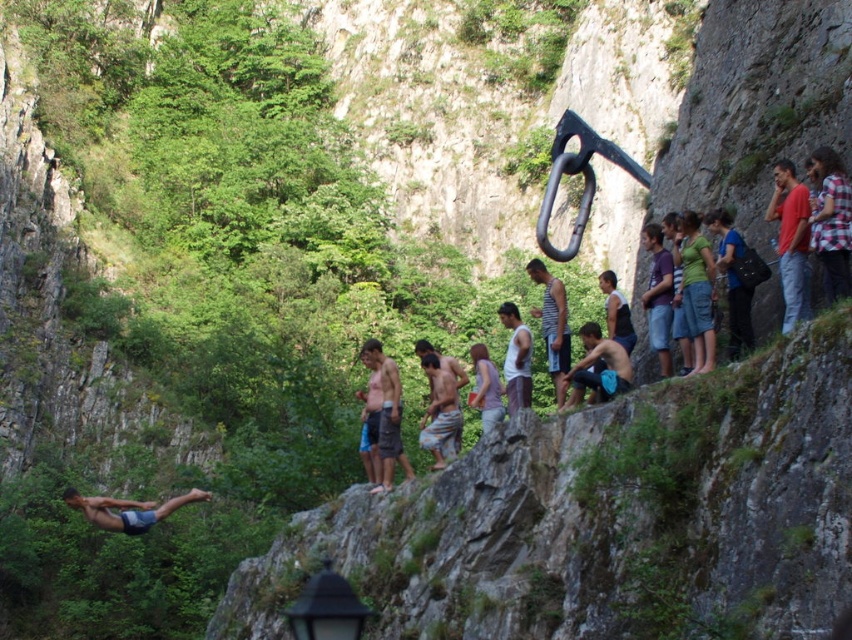
From the picture: Does brown rock cliff at center have a smaller size compared to blue denim shorts at lower left?

Actually, brown rock cliff at center might be larger than blue denim shorts at lower left.

Which is below, brown rock cliff at center or blue denim shorts at lower left?

blue denim shorts at lower left is below.

Who is more forward, (813, 483) or (95, 506)?

Point (813, 483) is more forward.

Find the location of a particular element. brown rock cliff at center is located at coordinates (605, 518).

Who is more forward, (435, 380) or (537, 264)?

Point (435, 380) is in front.

Find the location of `light brown woven shorts at center`. light brown woven shorts at center is located at coordinates (440, 413).

The image size is (852, 640). In order to click on light brown woven shorts at center in this screenshot , I will do `click(440, 413)`.

Can you confirm if red cotton shirt at right is thinner than light brown woven shorts at center?

Yes, red cotton shirt at right is thinner than light brown woven shorts at center.

Which is more to the right, red cotton shirt at right or light brown woven shorts at center?

red cotton shirt at right

This screenshot has height=640, width=852. I want to click on red cotton shirt at right, so click(792, 241).